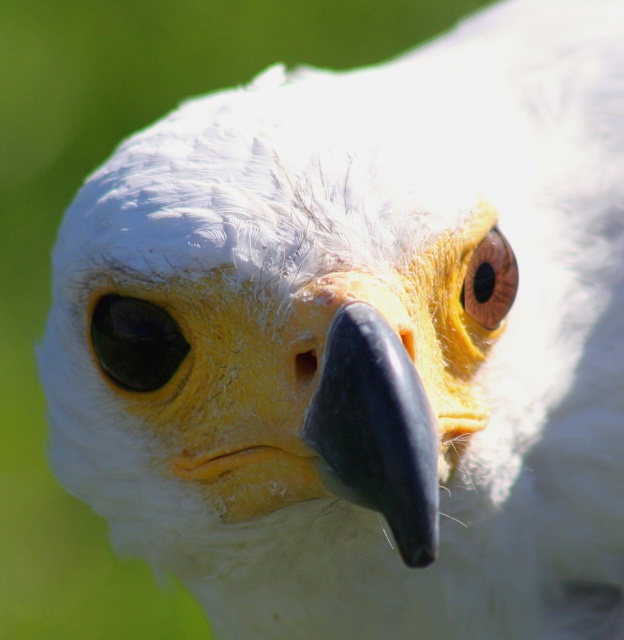
You are observing an eagle in the wild and notice two eyes on its head. Which eye, the shiny black eye at center or the brown glossy eye at upper center, is positioned closer to your viewpoint?

Answer: The shiny black eye at center is closer to the viewer than the brown glossy eye at upper center.

Consider the image. Looking at the eagle in the scene, which eye is positioned to the left when comparing the shiny black eye at center and the brown glossy eye at upper center?

The shiny black eye at center is positioned to the left of the brown glossy eye at upper center.

Looking at the eagle in the image, you notice two eyes. The shiny black eye at center and the brown glossy eye at upper center. Which eye is located lower on the eagle?

The shiny black eye at center is positioned under the brown glossy eye at upper center, so the shiny black eye at center is located lower on the eagle.